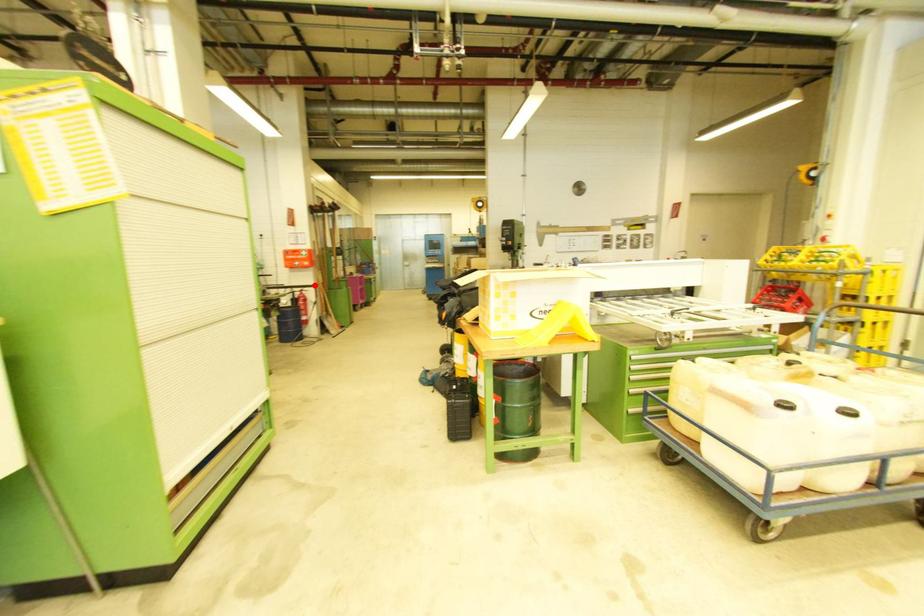
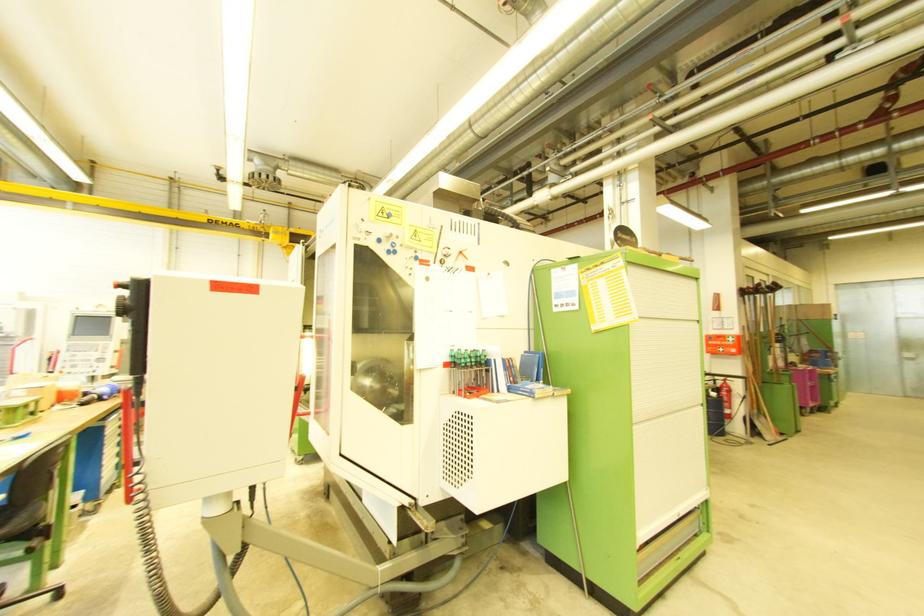
Question: I am providing you with two images of the same scene from different viewpoints. In image1, a red point is highlighted. Considering the same 3D point in image2, which of the following is correct?

Choices:
 (A) It is closer
 (B) It is farther

Answer: (B)